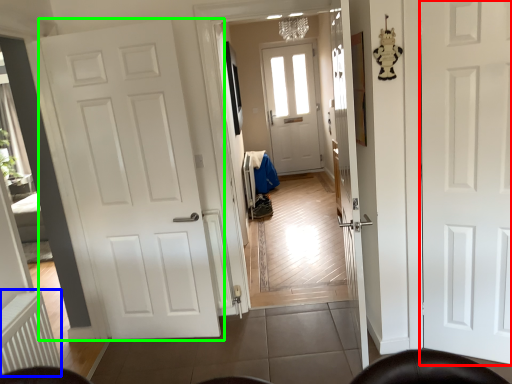
Question: Which object is the farthest from door (highlighted by a red box)? Choose among these: radiator (highlighted by a blue box) or door (highlighted by a green box).

Choices:
 (A) radiator
 (B) door

Answer: (A)